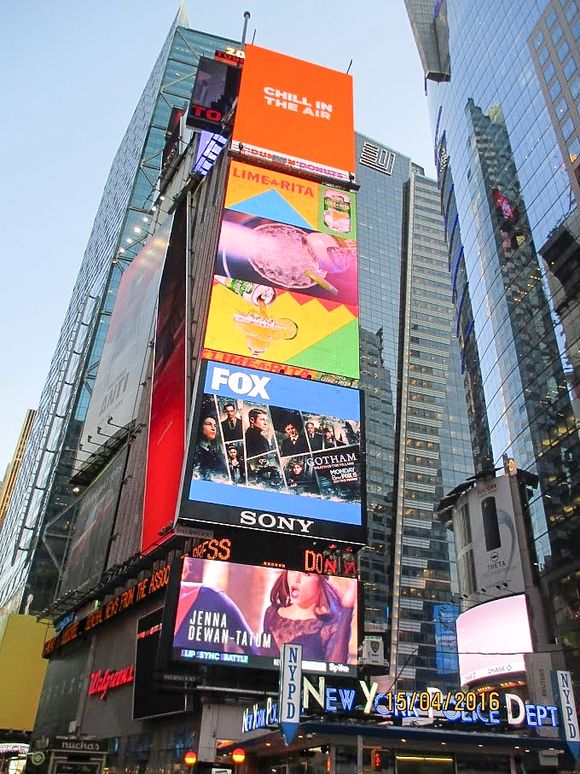
You are a GUI agent. You are given a task and a screenshot of the screen. Output one action in this format:
    pyautogui.click(x=<x>, y=<y>)
    Task: Click on the digital signs
    This screenshot has width=580, height=774.
    Given the screenshot: What is the action you would take?
    pyautogui.click(x=278, y=98), pyautogui.click(x=279, y=248), pyautogui.click(x=284, y=430), pyautogui.click(x=239, y=605)